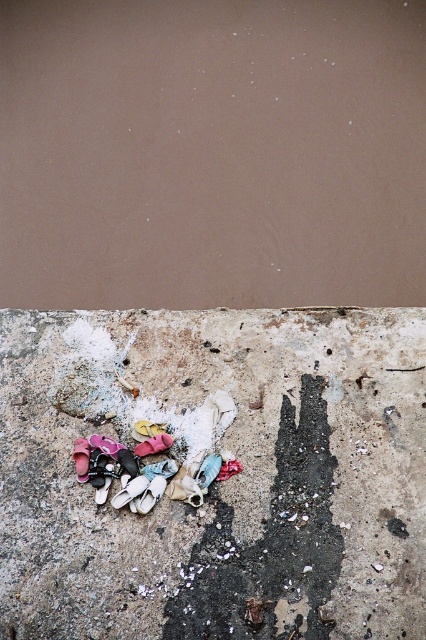
You are standing on the concrete surface and want to pick up the white fabric shoe at lower left. The flip flops are 4.02 meters away from you. Can you reach them without moving your feet?

The white fabric shoe at lower left is 4.02 meters away from you, so you cannot reach it without moving your feet because the average human arm length is about 0.7 meters.

You are standing at the center of the concrete surface and want to pick up the white fabric shoe at lower left. Which direction should you move to reach it?

Since the white fabric shoe at lower left is located at point (129,492), you should move towards the lower left direction to reach it.

You are trying to place a small plant pot between the dirty concrete shoes at bottom center and the pink fabric shoe at lower center. Considering their heights, which shoe should the pot be placed closer to and why?

The small plant pot should be placed closer to the pink fabric shoe at lower center because the dirty concrete shoes at bottom center is much taller, creating a larger shadow or uneven surface that might not be suitable for placing the pot.